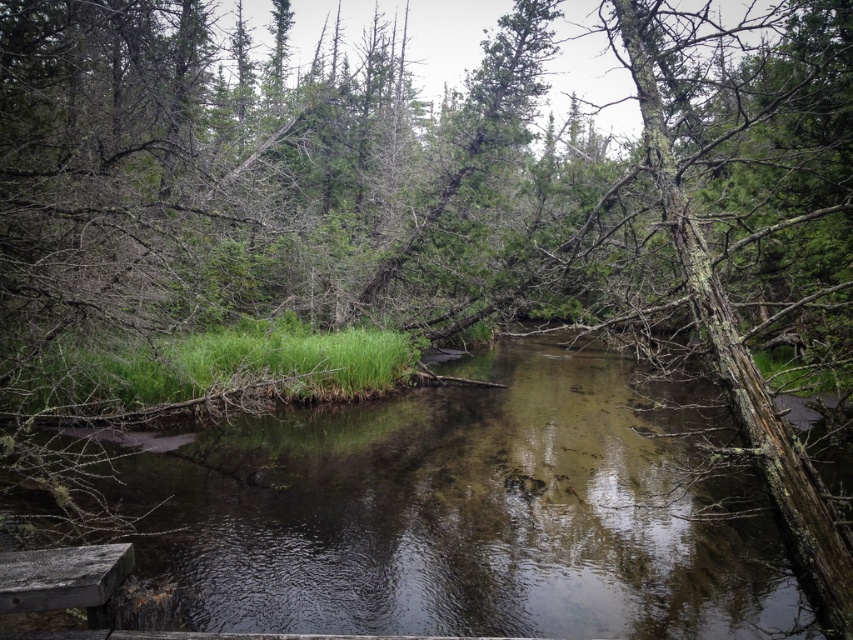
Who is taller, green grassy river at center or rusty wooden plank at lower left?

green grassy river at center

Does green grassy river at center have a smaller size compared to rusty wooden plank at lower left?

No, green grassy river at center is not smaller than rusty wooden plank at lower left.

Which is behind, point (279, 500) or point (7, 605)?

The point (279, 500) is behind.

Locate an element on the screen. green grassy river at center is located at coordinates click(465, 513).